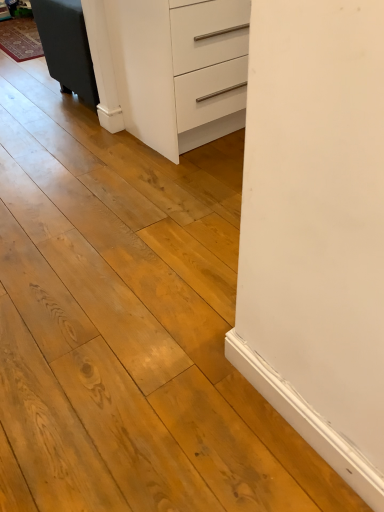
Where is `white glossy chest of drawers at upper center`? This screenshot has height=512, width=384. white glossy chest of drawers at upper center is located at coordinates (170, 68).

What do you see at coordinates (170, 68) in the screenshot? I see `white glossy chest of drawers at upper center` at bounding box center [170, 68].

Locate an element on the screen. white glossy chest of drawers at upper center is located at coordinates (170, 68).